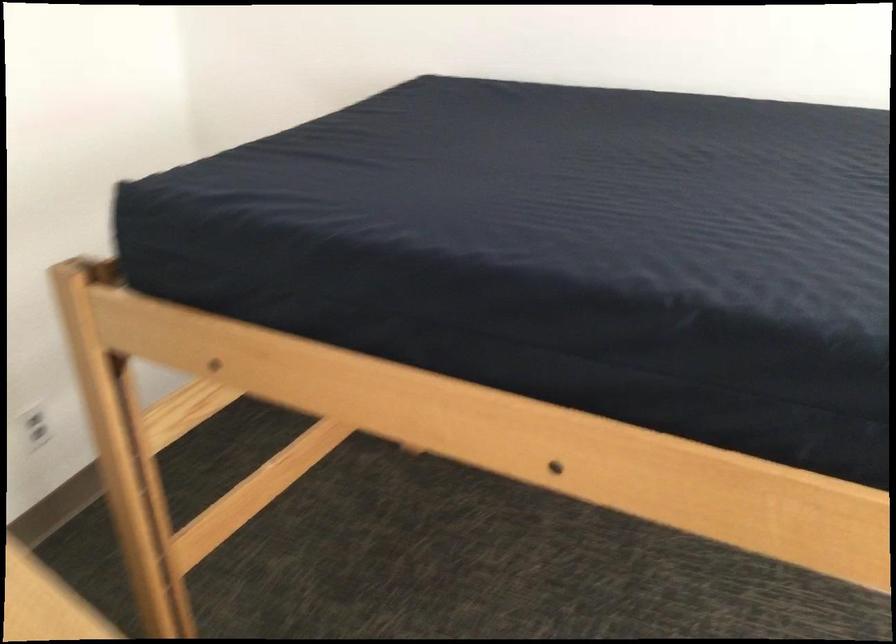
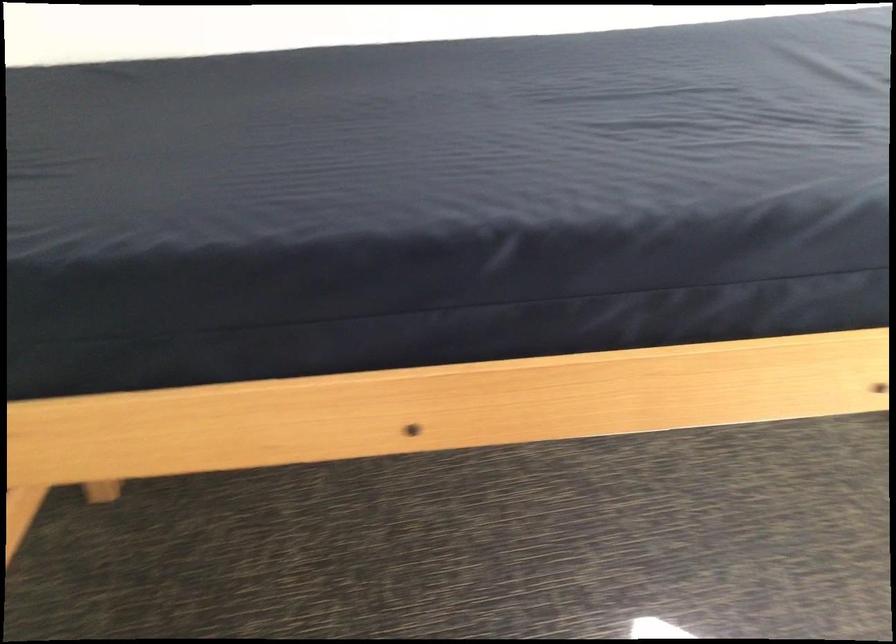
The point at (363, 393) is marked in the first image. Where is the corresponding point in the second image?

(165, 436)